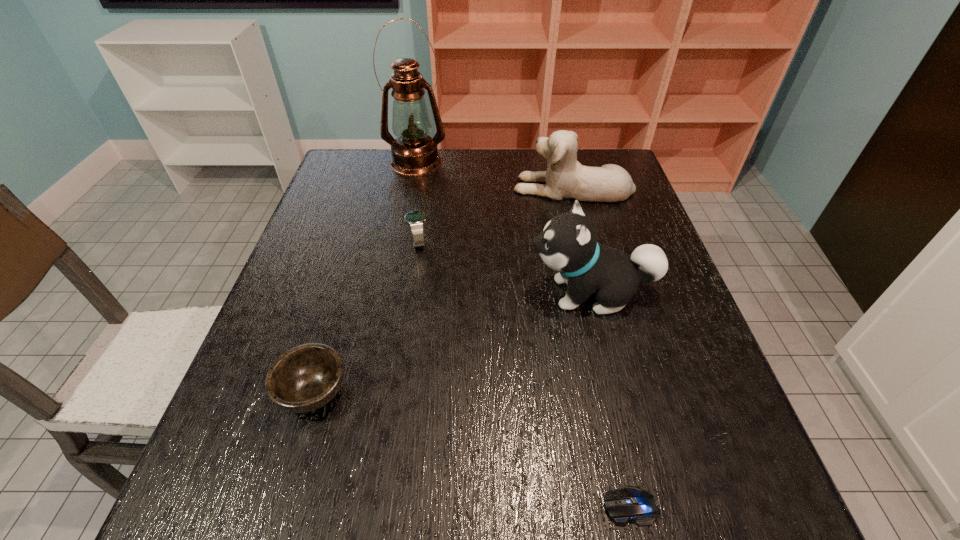
The height and width of the screenshot is (540, 960). I want to click on free space between the fifth tallest object and the tallest object, so click(x=365, y=276).

I want to click on free point between the fifth farthest object and the computer mouse, so click(472, 449).

You are a GUI agent. You are given a task and a screenshot of the screen. Output one action in this format:
    pyautogui.click(x=<x>, y=<y>)
    Task: Click on the free spot between the tallest object and the bowl
    The width and height of the screenshot is (960, 540).
    Given the screenshot: What is the action you would take?
    pyautogui.click(x=365, y=276)

The width and height of the screenshot is (960, 540). I want to click on vacant area between the bowl and the computer mouse, so click(472, 449).

Where is `object that can be found as the closest to the farther puppy`? The width and height of the screenshot is (960, 540). object that can be found as the closest to the farther puppy is located at coordinates (414, 152).

This screenshot has width=960, height=540. Identify the location of object that is the fourth closest one to the oil lamp. (305, 378).